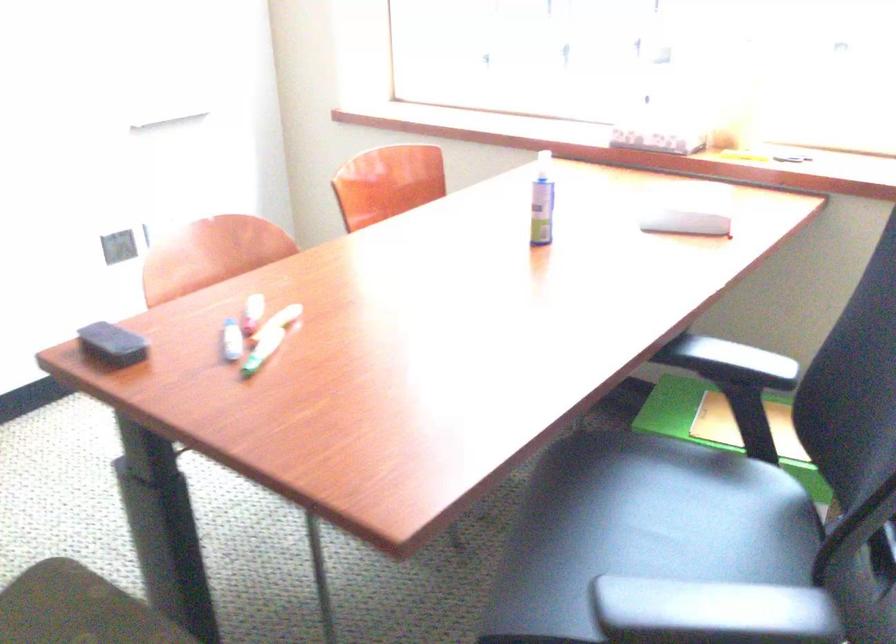
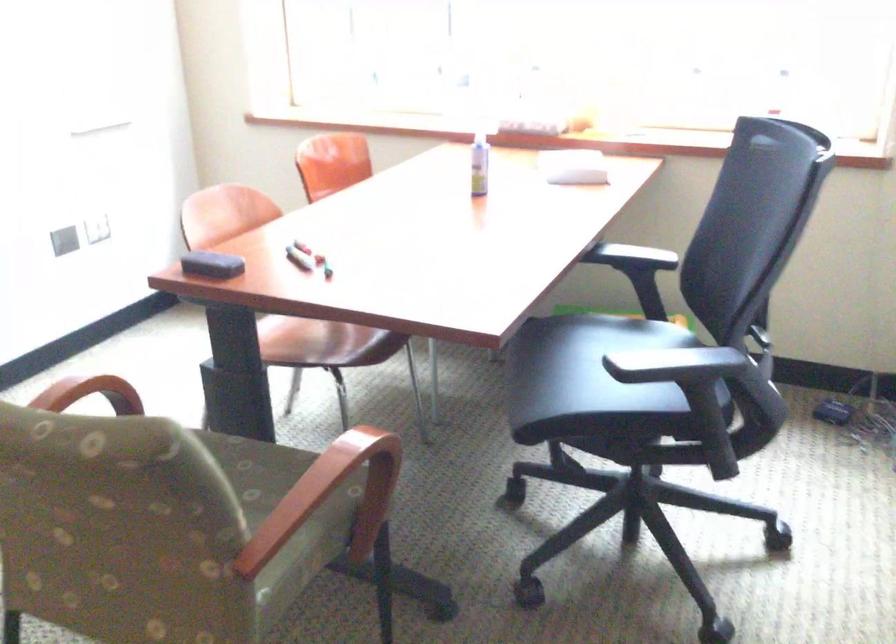
The point at (238, 335) is marked in the first image. Where is the corresponding point in the second image?

(299, 258)